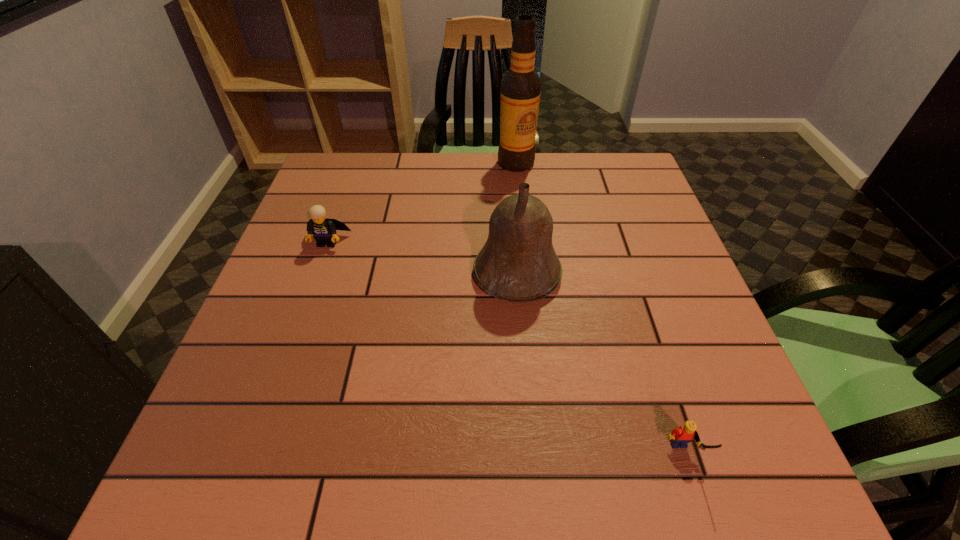
The width and height of the screenshot is (960, 540). Identify the location of the farthest object. (521, 85).

I want to click on the tallest object, so click(x=521, y=85).

The image size is (960, 540). What are the coordinates of `the third shortest object` in the screenshot? It's located at (518, 263).

The image size is (960, 540). Find the location of `the leftmost object`. the leftmost object is located at coordinates (323, 230).

Find the location of a particular element. Image resolution: width=960 pixels, height=540 pixels. the farther Lego is located at coordinates (323, 230).

Image resolution: width=960 pixels, height=540 pixels. Find the location of `the rightmost object`. the rightmost object is located at coordinates [x=680, y=437].

Where is `the nearest object`? the nearest object is located at coordinates (x=680, y=437).

Locate an element on the screen. vacant space located on the label of the alcohol is located at coordinates (525, 249).

This screenshot has width=960, height=540. I want to click on free space located 0.350m on the left of the third shortest object, so click(315, 274).

Locate an element on the screen. free space located 0.360m on the front-facing side of the left Lego is located at coordinates (275, 389).